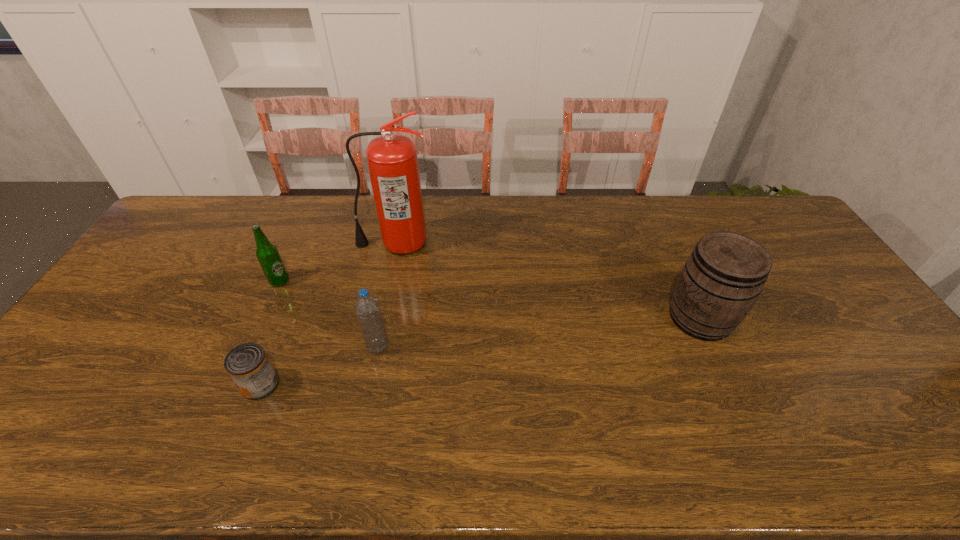
Locate an element on the screen. This screenshot has height=540, width=960. the farthest object is located at coordinates (392, 160).

This screenshot has width=960, height=540. I want to click on the tallest object, so click(392, 160).

This screenshot has width=960, height=540. I want to click on the rightmost object, so click(x=722, y=279).

The image size is (960, 540). In order to click on water bottle in this screenshot , I will do `click(367, 307)`.

The image size is (960, 540). I want to click on beer bottle, so click(267, 254).

This screenshot has width=960, height=540. Find the location of `can`. can is located at coordinates (248, 365).

You are a GUI agent. You are given a task and a screenshot of the screen. Output one action in this format:
    pyautogui.click(x=<x>, y=<y>)
    Task: Click on the shortest object
    This screenshot has height=540, width=960.
    Given the screenshot: What is the action you would take?
    pyautogui.click(x=248, y=365)

The height and width of the screenshot is (540, 960). Find the location of `free space located on the instruction side of the fire extinguisher`. free space located on the instruction side of the fire extinguisher is located at coordinates (379, 317).

The height and width of the screenshot is (540, 960). Find the location of `vacant space located on the back of the rightmost object`. vacant space located on the back of the rightmost object is located at coordinates (672, 255).

I want to click on blank space located on the back of the water bottle, so click(x=396, y=257).